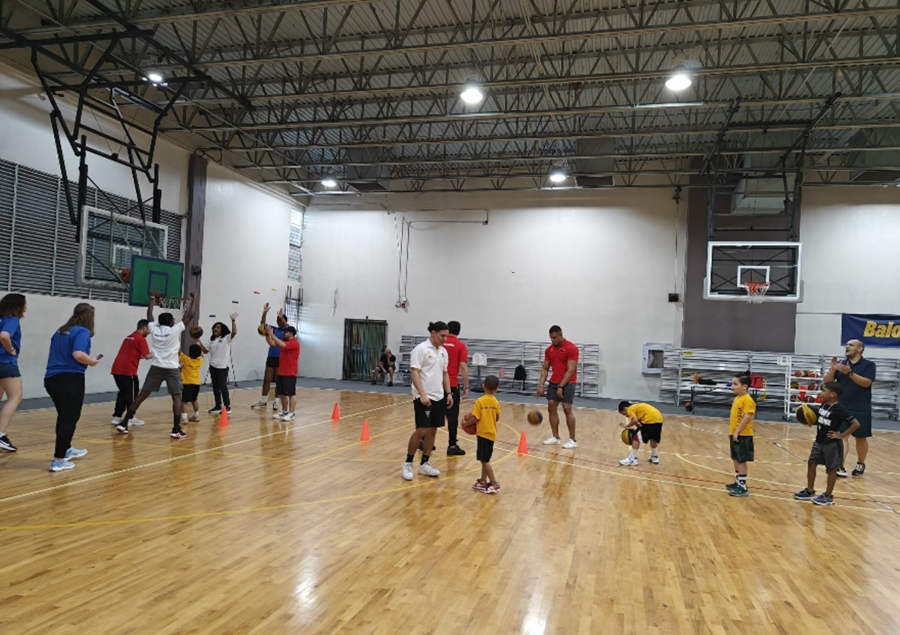
What are the coordinates of `door` in the screenshot? It's located at (365, 336).